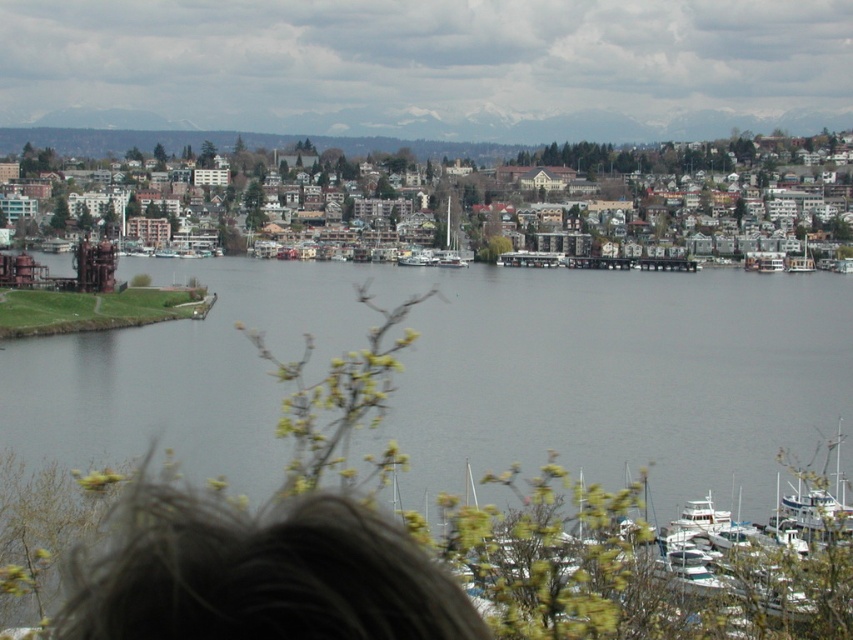
Question: Which point is farther to the camera?

Choices:
 (A) brown wooden houses at center
 (B) gray water at center

Answer: (A)

Question: Which of the following is the farthest from the observer?

Choices:
 (A) brown wooden houses at center
 (B) gray water at center
 (C) white glossy boat at lower right

Answer: (A)

Question: From the image, what is the correct spatial relationship of white glossy boat at lower right in relation to white glossy sailboat at center?

Choices:
 (A) above
 (B) below

Answer: (B)

Question: Which object is the closest to the brown wooden houses at center?

Choices:
 (A) white glossy sailboat at center
 (B) gray water at center
 (C) white glossy boat at lower right

Answer: (A)

Question: Is gray water at center above white glossy boat at lower right?

Choices:
 (A) yes
 (B) no

Answer: (A)

Question: Is white glossy boat at lower right to the left of white glossy sailboat at center from the viewer's perspective?

Choices:
 (A) yes
 (B) no

Answer: (B)